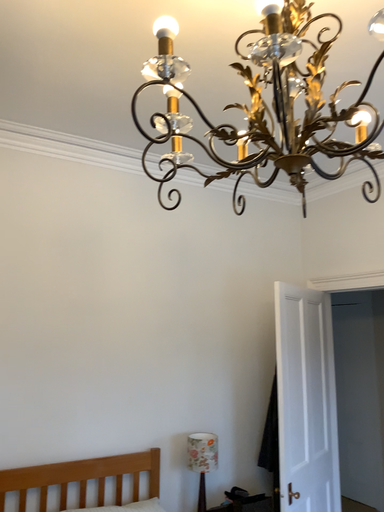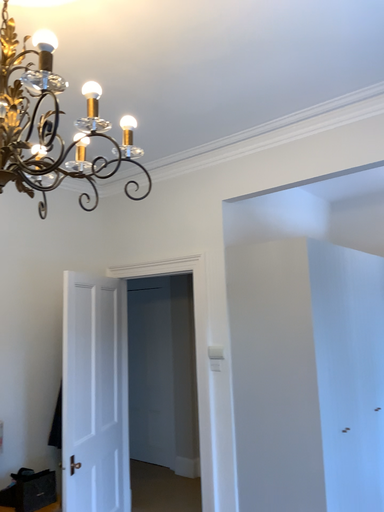
Question: How did the camera likely rotate when shooting the video?

Choices:
 (A) rotated right
 (B) rotated left

Answer: (A)